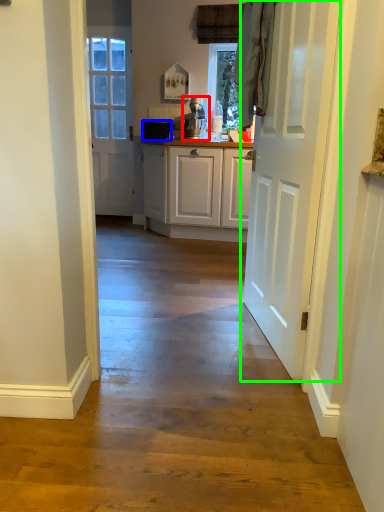
Question: Which object is positioned farthest from appliance (highlighted by a red box)? Select from appliance (highlighted by a blue box) and door (highlighted by a green box).

Choices:
 (A) appliance
 (B) door

Answer: (B)